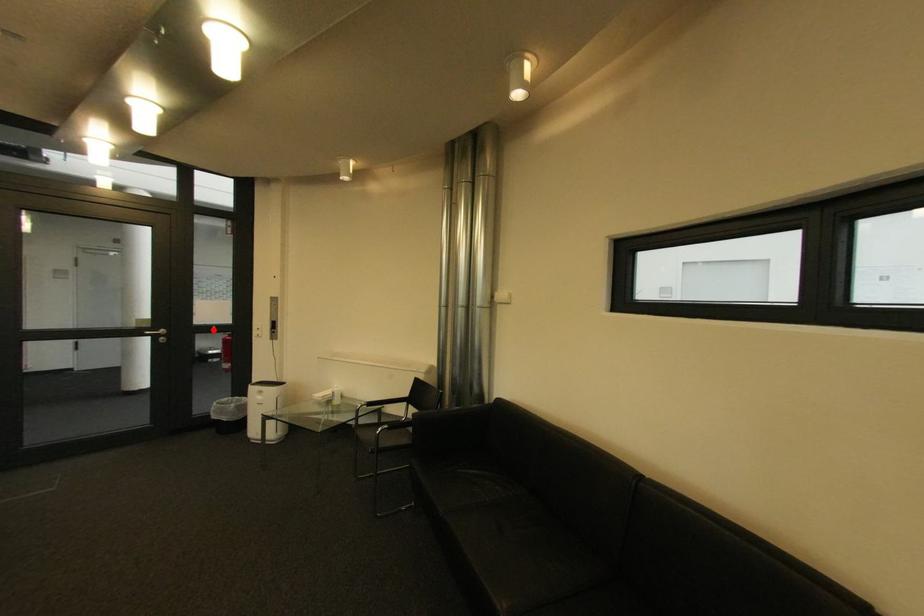
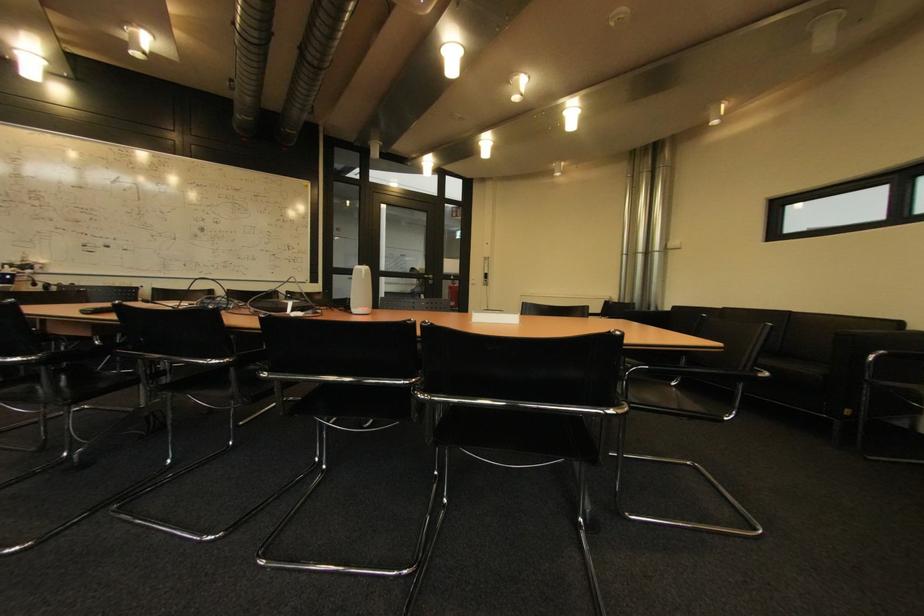
Where in the second image is the point corresponding to the highlighted location from the first image?

(456, 278)